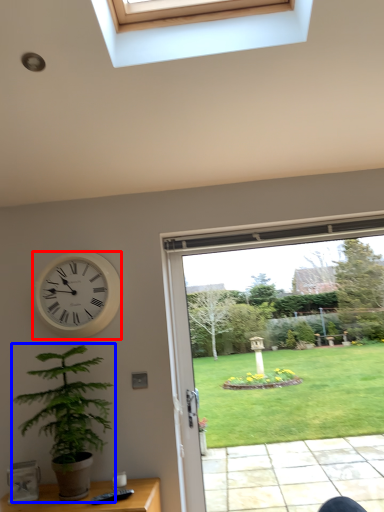
Question: Among these objects, which one is farthest to the camera, wall clock (highlighted by a red box) or houseplant (highlighted by a blue box)?

Choices:
 (A) wall clock
 (B) houseplant

Answer: (A)